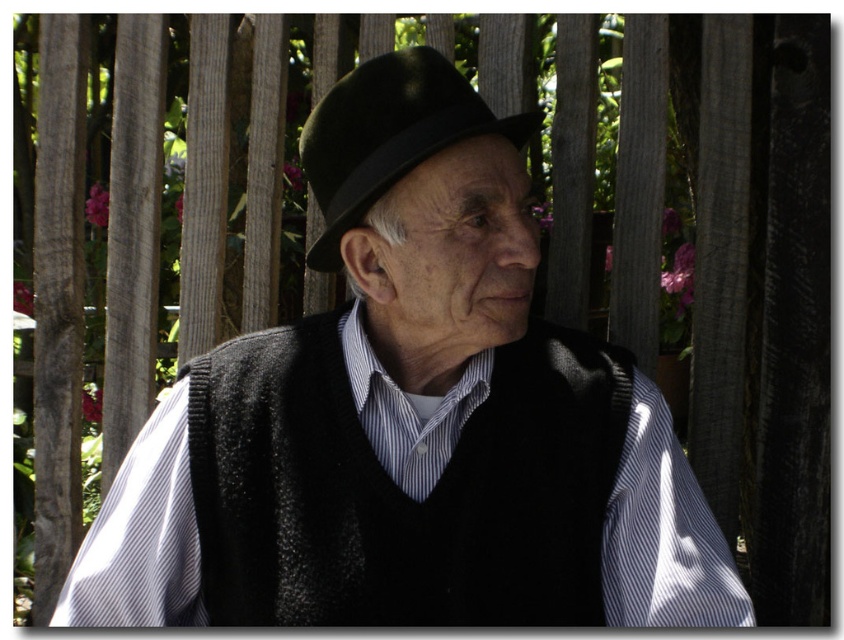
Question: Is black felt fedora at center smaller than white striped fabric at center?

Choices:
 (A) yes
 (B) no

Answer: (B)

Question: Does black felt fedora at center have a larger size compared to white striped fabric at center?

Choices:
 (A) no
 (B) yes

Answer: (B)

Question: Is black felt fedora at center smaller than white striped fabric at center?

Choices:
 (A) no
 (B) yes

Answer: (A)

Question: Which object appears closest to the camera in this image?

Choices:
 (A) black felt fedora at center
 (B) black knitted vest at center
 (C) white striped fabric at center

Answer: (A)

Question: Among these objects, which one is nearest to the camera?

Choices:
 (A) black felt fedora at center
 (B) black knitted vest at center

Answer: (A)

Question: Estimate the real-world distances between objects in this image. Which object is farther from the white striped fabric at center?

Choices:
 (A) black knitted vest at center
 (B) black felt fedora at center

Answer: (B)